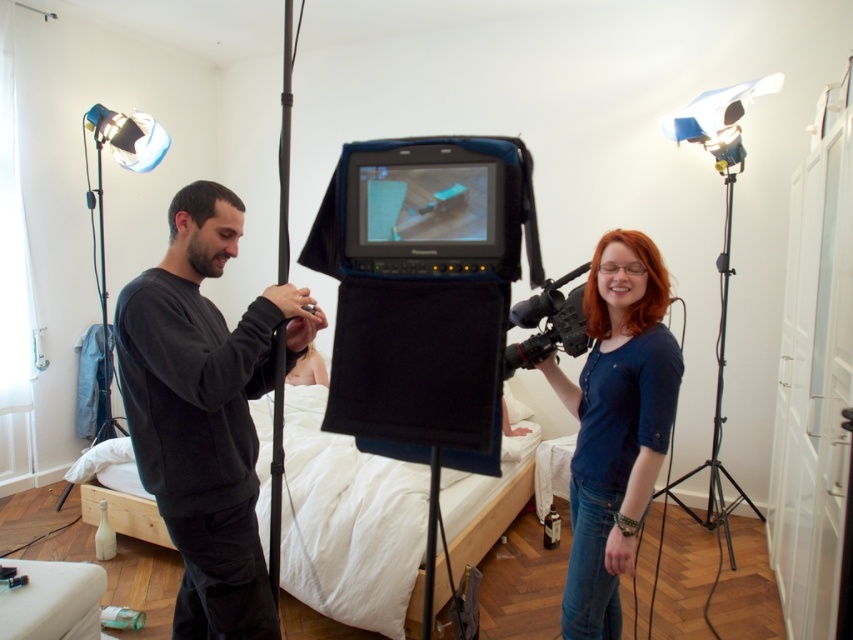
Which is behind, point (131, 404) or point (566, 333)?

Positioned behind is point (566, 333).

This screenshot has height=640, width=853. Describe the element at coordinates (206, 410) in the screenshot. I see `black matte sweatshirt at center` at that location.

Locate an element on the screen. This screenshot has width=853, height=640. black matte sweatshirt at center is located at coordinates click(x=206, y=410).

Does white fabric bed at center lie in front of blue cotton shirt at right?

No, it is behind blue cotton shirt at right.

Which is below, white fabric bed at center or blue cotton shirt at right?

white fabric bed at center

The width and height of the screenshot is (853, 640). What do you see at coordinates (347, 522) in the screenshot? I see `white fabric bed at center` at bounding box center [347, 522].

You are a GUI agent. You are given a task and a screenshot of the screen. Output one action in this format:
    pyautogui.click(x=<x>, y=<y>)
    Task: Click on the white fabric bed at center
    The image size is (853, 640).
    Given the screenshot: What is the action you would take?
    pyautogui.click(x=347, y=522)

Who is more distant from viewer, (218,600) or (669,488)?

The point (669,488) is more distant.

From the picture: Can you confirm if black matte sweatshirt at center is shorter than black metal tripod at right?

Yes, black matte sweatshirt at center is shorter than black metal tripod at right.

Measure the distance between point (194, 604) and camera.

A distance of 6.47 feet exists between point (194, 604) and camera.

Where is `black matte sweatshirt at center`? The height and width of the screenshot is (640, 853). black matte sweatshirt at center is located at coordinates pos(206,410).